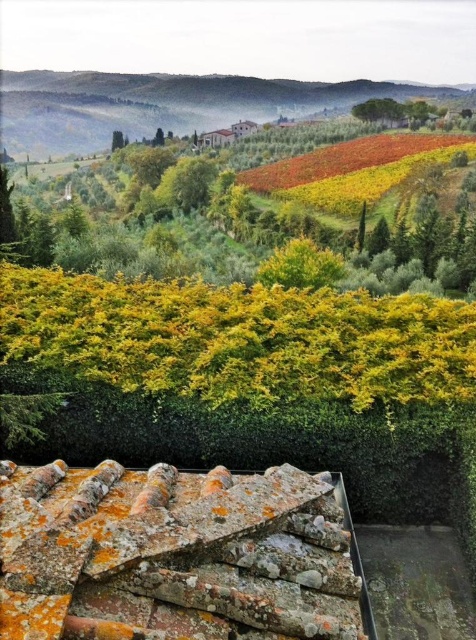
Question: Which point appears farthest from the camera in this image?

Choices:
 (A) (228, 106)
 (B) (120, 134)

Answer: (A)

Question: Which of the following is the farthest from the observer?

Choices:
 (A) rusty terracotta tiles at center
 (B) green leafy tree at center

Answer: (B)

Question: Considering the relative positions of green grassy hillside at upper center and green leafy tree at center in the image provided, where is green grassy hillside at upper center located with respect to green leafy tree at center?

Choices:
 (A) below
 (B) above

Answer: (B)

Question: Which of these objects is positioned closest to the green grassy hillside at upper center?

Choices:
 (A) rusty terracotta tiles at center
 (B) green leafy tree at center

Answer: (B)

Question: Is green grassy hillside at upper center to the left of green leafy tree at center from the viewer's perspective?

Choices:
 (A) no
 (B) yes

Answer: (A)

Question: Is green grassy hillside at upper center positioned in front of green leafy tree at center?

Choices:
 (A) yes
 (B) no

Answer: (B)